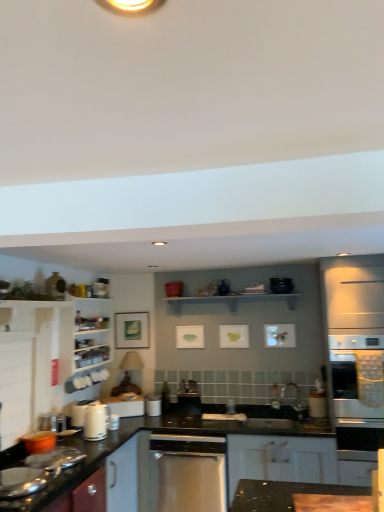
Question: Is white wooden shelf at upper center bigger than black glossy countertop at lower left, the first countertop from the left?

Choices:
 (A) yes
 (B) no

Answer: (B)

Question: Does white wooden shelf at upper center come in front of black glossy countertop at lower left, which is the 1th countertop in back-to-front order?

Choices:
 (A) no
 (B) yes

Answer: (A)

Question: Is white wooden shelf at upper center facing towards black glossy countertop at lower left, which ranks as the second countertop in right-to-left order?

Choices:
 (A) no
 (B) yes

Answer: (A)

Question: From the image's perspective, does white wooden shelf at upper center appear lower than black glossy countertop at lower left, which is the 1th countertop in back-to-front order?

Choices:
 (A) no
 (B) yes

Answer: (A)

Question: Is white wooden shelf at upper center next to black glossy countertop at lower left, which is counted as the first countertop, starting from the bottom?

Choices:
 (A) no
 (B) yes

Answer: (A)

Question: From a real-world perspective, is brown wooden countertop at lower right, the 1th countertop when ordered from front to back, positioned above or below white glossy kettle at lower left?

Choices:
 (A) above
 (B) below

Answer: (B)

Question: Considering the positions of brown wooden countertop at lower right, which is counted as the first countertop, starting from the right, and white glossy kettle at lower left in the image, is brown wooden countertop at lower right, which is counted as the first countertop, starting from the right, wider or thinner than white glossy kettle at lower left?

Choices:
 (A) wide
 (B) thin

Answer: (A)

Question: In the image, is brown wooden countertop at lower right, which appears as the 2th countertop when viewed from the back, positioned in front of or behind white glossy kettle at lower left?

Choices:
 (A) behind
 (B) front

Answer: (B)

Question: Does point (276, 506) appear closer or farther from the camera than point (102, 403)?

Choices:
 (A) closer
 (B) farther

Answer: (A)

Question: From the image's perspective, is white glossy microwave at right, arranged as the first appliance when viewed from the front, located above or below brown wooden countertop at lower right, placed as the 2th countertop when sorted from bottom to top?

Choices:
 (A) below
 (B) above

Answer: (A)

Question: Looking at their shapes, would you say white glossy microwave at right, arranged as the 2th appliance when viewed from the back, is wider or thinner than brown wooden countertop at lower right, which is counted as the first countertop, starting from the right?

Choices:
 (A) wide
 (B) thin

Answer: (B)

Question: Considering the positions of point (324, 410) and point (230, 507), is point (324, 410) closer or farther from the camera than point (230, 507)?

Choices:
 (A) farther
 (B) closer

Answer: (A)

Question: Considering their positions, is white glossy microwave at right, arranged as the first appliance when viewed from the front, located in front of or behind brown wooden countertop at lower right, which is the first countertop from top to bottom?

Choices:
 (A) front
 (B) behind

Answer: (B)

Question: From a real-world perspective, relative to black glossy countertop at lower left, the second countertop viewed from the front, is white glossy microwave at right, acting as the 2th appliance starting from the left, vertically above or below?

Choices:
 (A) above
 (B) below

Answer: (A)

Question: Based on their sizes in the image, would you say white glossy microwave at right, arranged as the first appliance when viewed from the front, is bigger or smaller than black glossy countertop at lower left, which ranks as the second countertop in right-to-left order?

Choices:
 (A) big
 (B) small

Answer: (B)